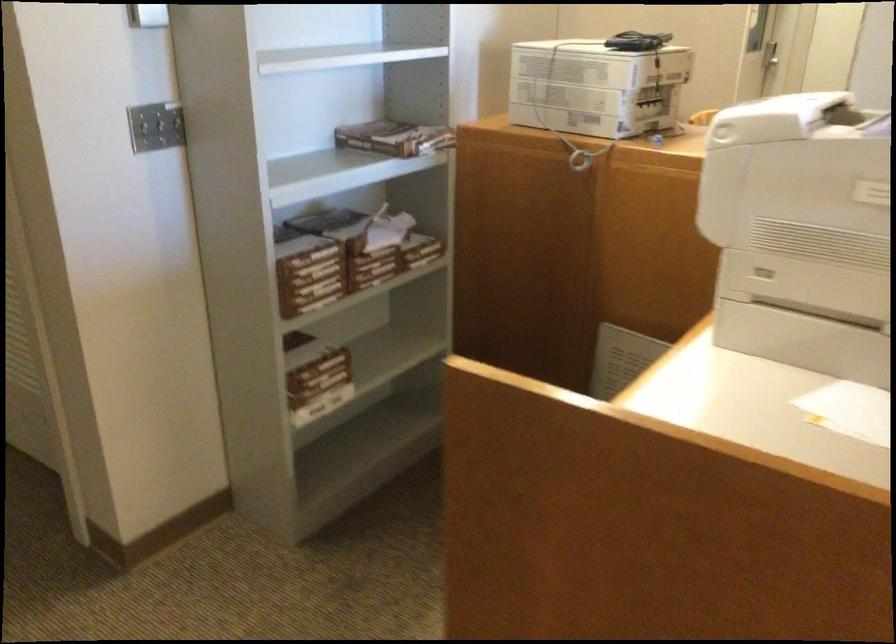
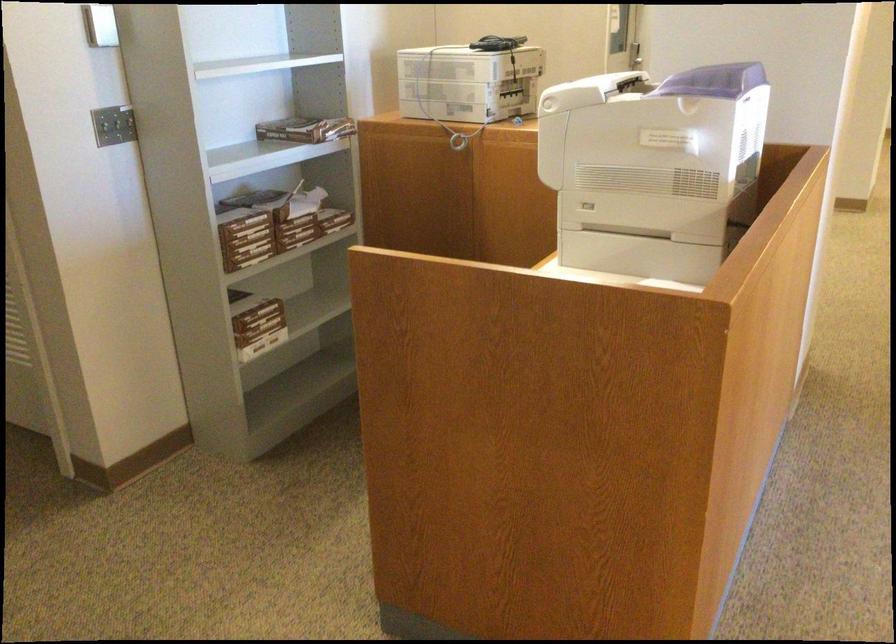
The point at (312,277) is marked in the first image. Where is the corresponding point in the second image?

(246, 237)